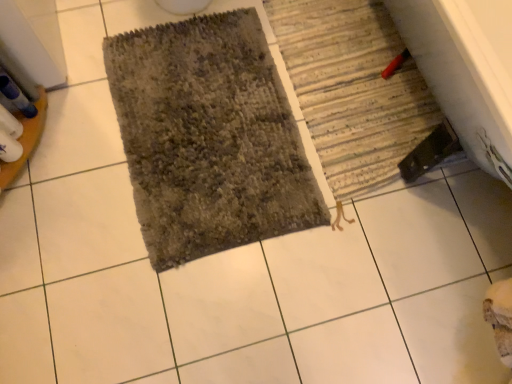
Locate an element on the screen. Image resolution: width=512 pixels, height=384 pixels. free spot above textured gray bath mat at center, which is the 2th bath mat in right-to-left order (from a real-world perspective) is located at coordinates (211, 124).